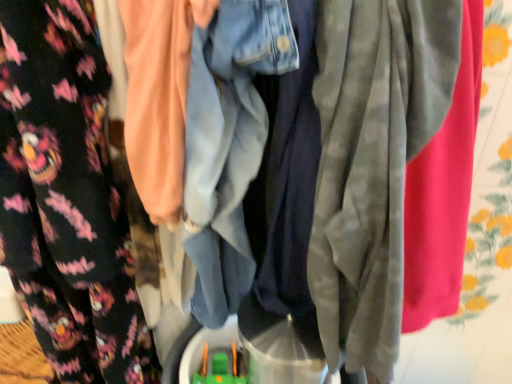
What do you see at coordinates (66, 197) in the screenshot?
I see `floral fleece pants at left` at bounding box center [66, 197].

Where is `floral fleece pants at left`? This screenshot has width=512, height=384. floral fleece pants at left is located at coordinates (66, 197).

Measure the distance between floral fleece pants at left and camera.

floral fleece pants at left is 22.78 inches away from camera.

What are the coordinates of `green plastic toy at center` in the screenshot? It's located at (220, 368).

This screenshot has height=384, width=512. What do you see at coordinates (220, 368) in the screenshot? I see `green plastic toy at center` at bounding box center [220, 368].

Measure the distance between point (205, 372) and camera.

Point (205, 372) and camera are 3.28 feet apart from each other.

Where is `floral fleece pants at left`? The image size is (512, 384). floral fleece pants at left is located at coordinates (66, 197).

Considering the positions of objects floral fleece pants at left and green plastic toy at center in the image provided, who is more to the right, floral fleece pants at left or green plastic toy at center?

green plastic toy at center is more to the right.

Which is behind, floral fleece pants at left or green plastic toy at center?

green plastic toy at center.

Which is nearer, (0, 20) or (203, 376)?

The point (0, 20) is more forward.

From the image's perspective, which object appears higher, floral fleece pants at left or green plastic toy at center?

floral fleece pants at left appears higher in the image.

In the scene shown: From a real-world perspective, is floral fleece pants at left on green plastic toy at center?

Yes.

Which object is thinner, floral fleece pants at left or green plastic toy at center?

Thinner between the two is green plastic toy at center.

From their relative heights in the image, would you say floral fleece pants at left is taller or shorter than green plastic toy at center?

Clearly, floral fleece pants at left is taller compared to green plastic toy at center.

In the scene shown: Does floral fleece pants at left have a larger size compared to green plastic toy at center?

Yes, floral fleece pants at left is bigger than green plastic toy at center.

Is floral fleece pants at left inside or outside of green plastic toy at center?

floral fleece pants at left exists outside the volume of green plastic toy at center.

In the scene shown: Is floral fleece pants at left directly adjacent to green plastic toy at center?

No, floral fleece pants at left is not touching green plastic toy at center.

Is floral fleece pants at left turned away from green plastic toy at center?

That's not correct — floral fleece pants at left is not looking away from green plastic toy at center.

How different are the orientations of floral fleece pants at left and green plastic toy at center in degrees?

floral fleece pants at left and green plastic toy at center are facing 2.31 degrees away from each other.

The width and height of the screenshot is (512, 384). I want to click on fancy dress that appears above the green plastic toy at center (from the image's perspective), so click(x=66, y=197).

Is green plastic toy at center at the right side of floral fleece pants at left?

Yes, green plastic toy at center is to the right of floral fleece pants at left.

In the image, is green plastic toy at center positioned in front of or behind floral fleece pants at left?

green plastic toy at center is behind floral fleece pants at left.

Between point (234, 354) and point (66, 370), which one is positioned in front?

The point (66, 370) is closer to the camera.

From the image's perspective, is green plastic toy at center above or below floral fleece pants at left?

green plastic toy at center is below floral fleece pants at left.

From a real-world perspective, is green plastic toy at center located higher than floral fleece pants at left?

Incorrect, from a real-world perspective, green plastic toy at center is lower than floral fleece pants at left.

Can you confirm if green plastic toy at center is thinner than floral fleece pants at left?

Yes.

From their relative heights in the image, would you say green plastic toy at center is taller or shorter than floral fleece pants at left?

Considering their sizes, green plastic toy at center has less height than floral fleece pants at left.

Considering the sizes of objects green plastic toy at center and floral fleece pants at left in the image provided, who is bigger, green plastic toy at center or floral fleece pants at left?

floral fleece pants at left.

Is floral fleece pants at left surrounded by green plastic toy at center?

No, floral fleece pants at left is not a part of green plastic toy at center.

Is green plastic toy at center next to floral fleece pants at left and touching it?

No, green plastic toy at center is not making contact with floral fleece pants at left.

Is green plastic toy at center oriented towards floral fleece pants at left?

No, green plastic toy at center is not facing towards floral fleece pants at left.

Find the location of a particular element. The height and width of the screenshot is (384, 512). toy on the right of the floral fleece pants at left is located at coordinates (220, 368).

This screenshot has width=512, height=384. In order to click on toy that is behind the floral fleece pants at left in this screenshot , I will do point(220,368).

You are a GUI agent. You are given a task and a screenshot of the screen. Output one action in this format:
    pyautogui.click(x=<x>, y=<y>)
    Task: Click on the toy below the floral fleece pants at left (from a real-world perspective)
    This screenshot has height=384, width=512.
    Given the screenshot: What is the action you would take?
    pyautogui.click(x=220, y=368)